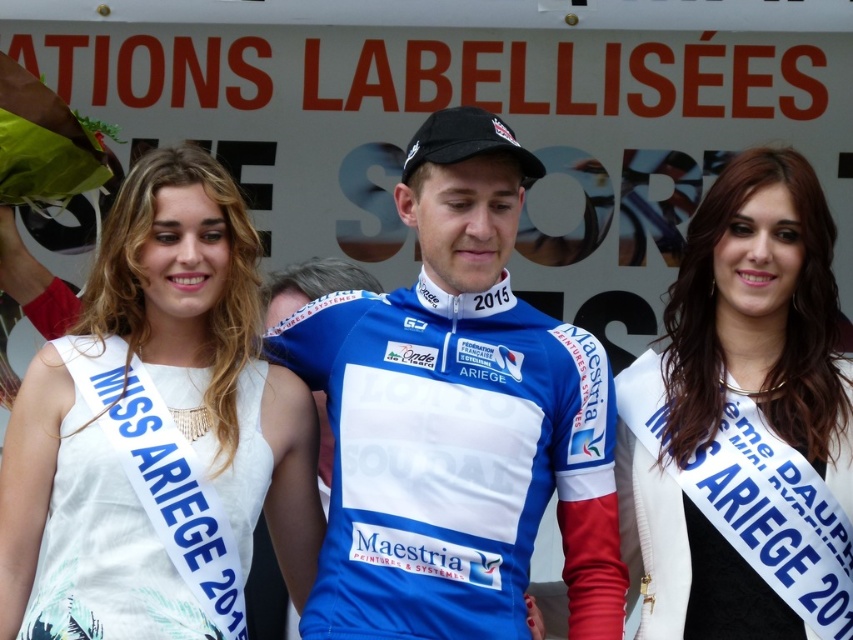
You are a photographer at the event and need to capture a photo where both the blue jersey at center and the white satin sash at right are visible. Based on their positions, which object should you focus on first to ensure both are in frame?

The blue jersey at center is positioned on the left side of white satin sash at right. To ensure both are in frame, focus on the blue jersey at center first as it is closer to the left, allowing the white satin sash at right to naturally fall into the right side of the frame.

You are a photographer at the event and need to position yourself to capture both the white satin sash at left and the white fabric dress at center in the same frame. Based on their positions, which object should be placed closer to the right side of your camera frame?

The white satin sash at left is to the right of the white fabric dress at center, so it should be positioned closer to the right side of the camera frame.

In the scene shown: You are a photographer at the event, and you need to capture a photo of the blue jersey at center and the white satin sash at right. Based on their positions, which object is closer to the bottom of the image?

The blue jersey at center is positioned under the white satin sash at right, so it is closer to the bottom of the image.